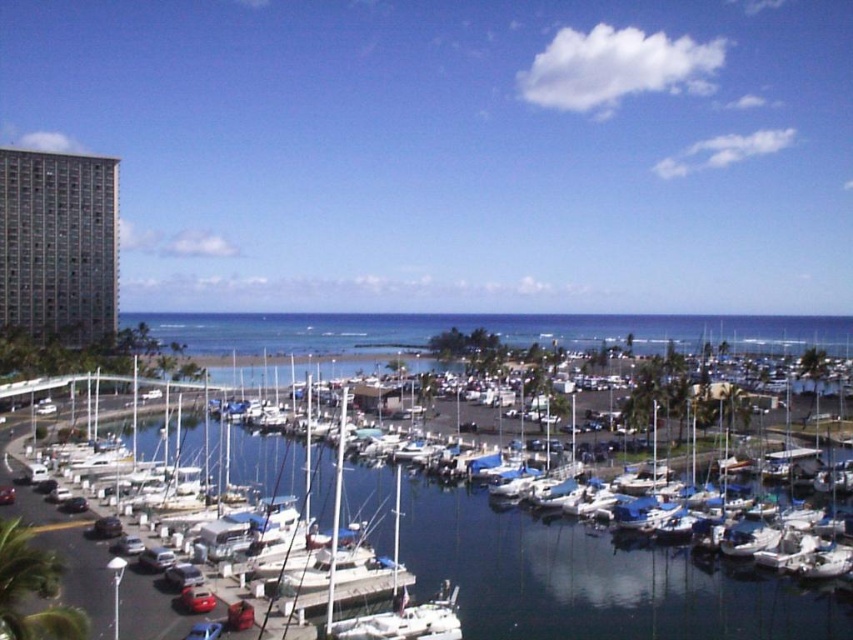
You are a photographer planning to take a photo of the gray glass building at left and the blue tarpaulin boat at center. Which object will appear larger in the photo?

The gray glass building at left will appear larger in the photo because it is positioned over the blue tarpaulin boat at center, indicating it is closer to the camera, and objects closer to the camera appear larger.

You are a photographer planning to take a photo of the blue tarpaulin boat at center and the gray glass building at left. From your current position, which object will appear closer to you in the photo?

The gray glass building at left will appear closer to you in the photo because the blue tarpaulin boat at center is positioned behind it.